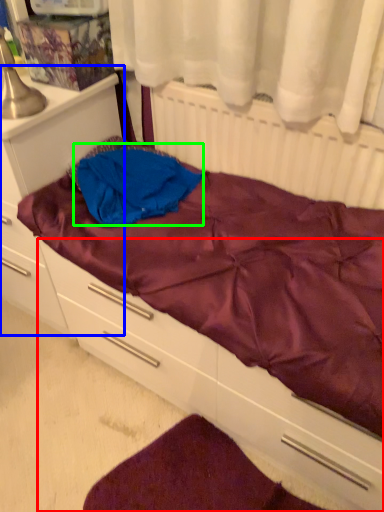
Question: Which object is the closest to the drawer (highlighted by a red box)? Choose among these: file cabinet (highlighted by a blue box) or clothing (highlighted by a green box).

Choices:
 (A) file cabinet
 (B) clothing

Answer: (B)